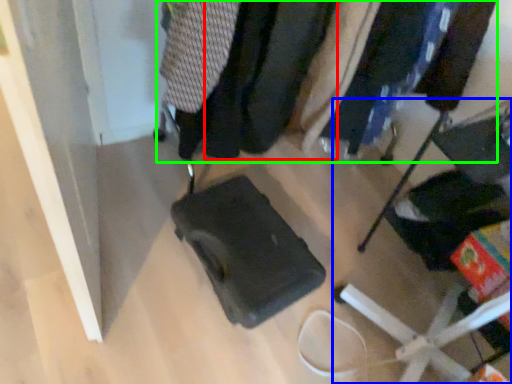
Question: Which object is positioned farthest from clothing (highlighted by a red box)? Select from furniture (highlighted by a blue box) and closet (highlighted by a green box).

Choices:
 (A) furniture
 (B) closet

Answer: (A)